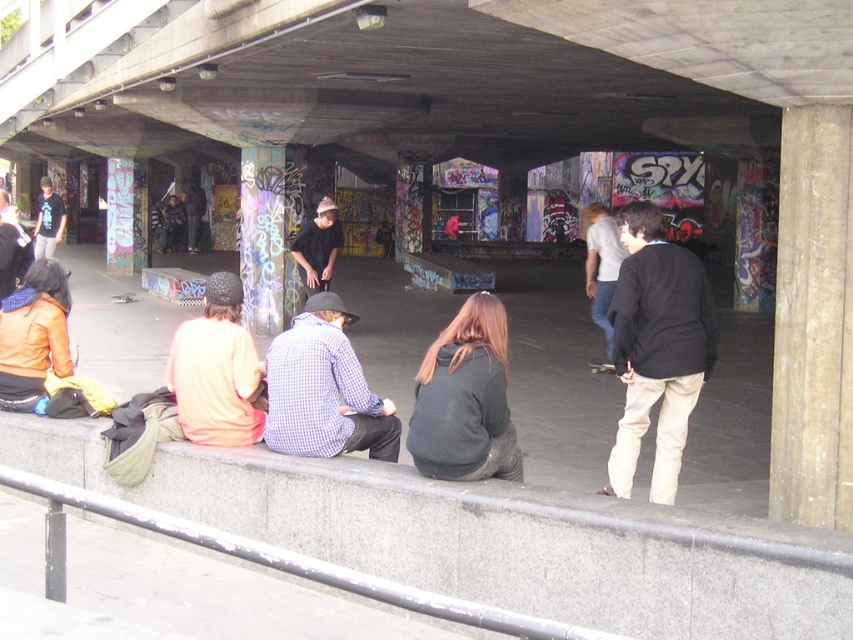
Is point (759, 598) behind point (370, 452)?

No, (759, 598) is in front of (370, 452).

Consider the image. Is gray concrete curb at lower center below checkered fabric shirt at center?

Yes, gray concrete curb at lower center is below checkered fabric shirt at center.

At what (x,y) coordinates should I click in order to perform the action: click on gray concrete curb at lower center. Please return your answer as a coordinate pair (x, y). Image resolution: width=853 pixels, height=640 pixels. Looking at the image, I should click on (486, 538).

Is point (398, 419) positioned in front of point (323, 198)?

Yes, it is.

Who is more forward, (305, 420) or (334, 248)?

Point (305, 420) is in front.

Locate an element on the screen. The width and height of the screenshot is (853, 640). checkered fabric shirt at center is located at coordinates (323, 388).

Does checkered fabric shirt at center have a lesser height compared to light brown leather jacket at center?

Indeed, checkered fabric shirt at center has a lesser height compared to light brown leather jacket at center.

At what (x,y) coordinates should I click in order to perform the action: click on checkered fabric shirt at center. Please return your answer as a coordinate pair (x, y). This screenshot has width=853, height=640. Looking at the image, I should click on (323, 388).